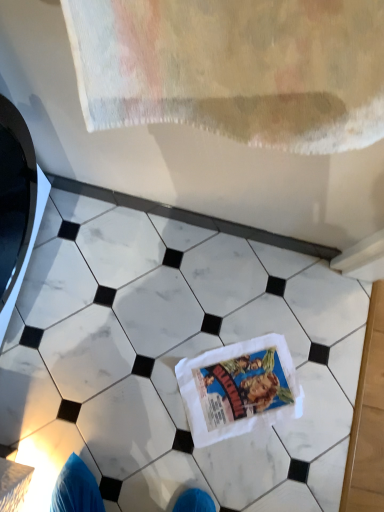
Locate an element on the screen. The image size is (384, 512). vacant space in front of white cotton comic book at center is located at coordinates (218, 465).